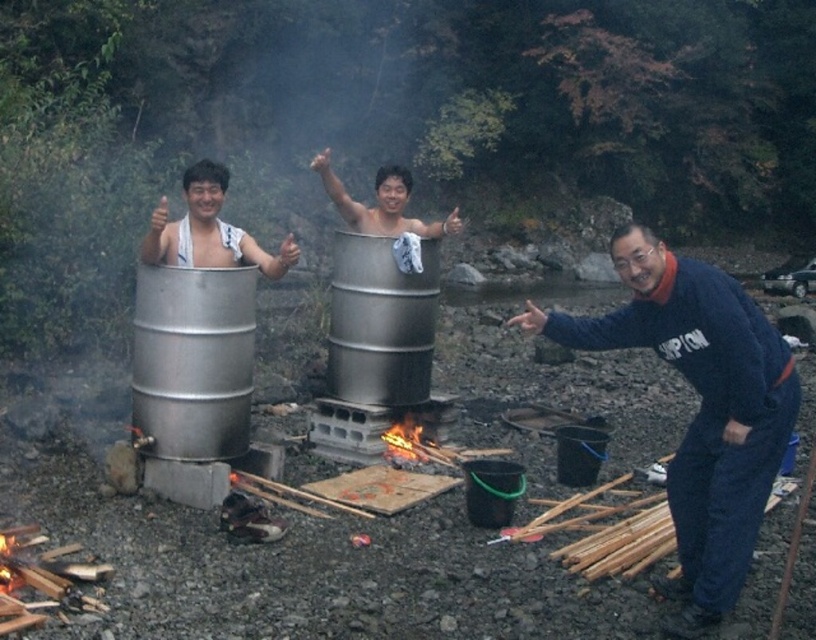
From the picture: You are organizing a camping trip and need to know the location of your blue fleece jacket at lower right relative to the silver metallic tub at center. Is it on the left or right side?

The blue fleece jacket at lower right is to the right of the silver metallic tub at center.